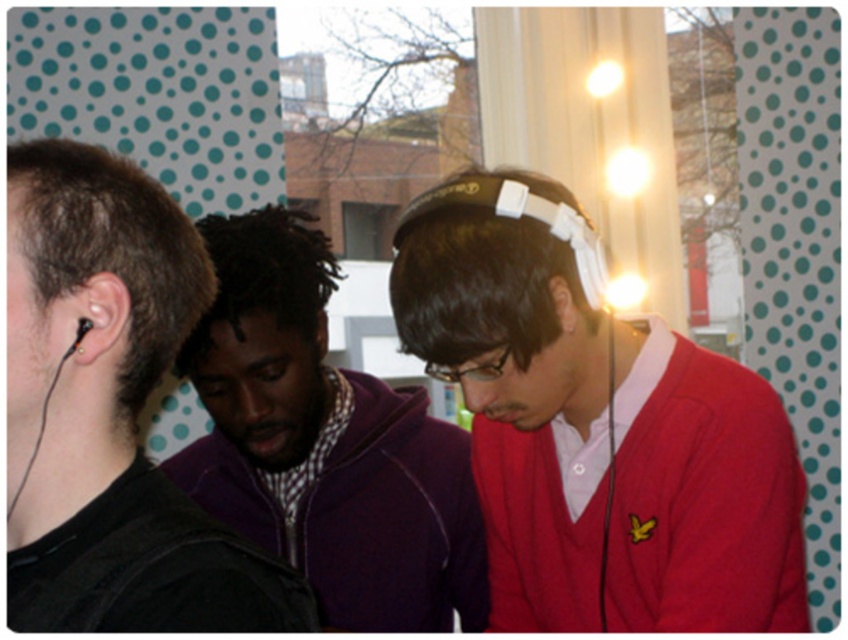
Does matte black ear at center come in front of black matte earphone at left?

No, matte black ear at center is behind black matte earphone at left.

Does matte black ear at center have a greater height compared to black matte earphone at left?

Indeed, matte black ear at center has a greater height compared to black matte earphone at left.

Is point (322, 348) less distant than point (71, 352)?

No, (322, 348) is behind (71, 352).

Identify the location of matte black ear at center. The image size is (848, 640). (321, 333).

Does point (244, 600) lie behind point (296, 337)?

No.

Is black matte earphones at left above purple fleece jacket at center?

Indeed, black matte earphones at left is positioned over purple fleece jacket at center.

Is point (26, 564) less distant than point (472, 536)?

Yes, it is in front of point (472, 536).

Where is `black matte earphones at left`? Image resolution: width=848 pixels, height=640 pixels. black matte earphones at left is located at coordinates (110, 417).

Who is shorter, purple fleece jacket at center or black matte earbud at left?

black matte earbud at left is shorter.

At what (x,y) coordinates should I click in order to perform the action: click on purple fleece jacket at center. Please return your answer as a coordinate pair (x, y). Looking at the image, I should click on (324, 444).

Find the location of a particular element. The height and width of the screenshot is (640, 848). purple fleece jacket at center is located at coordinates (324, 444).